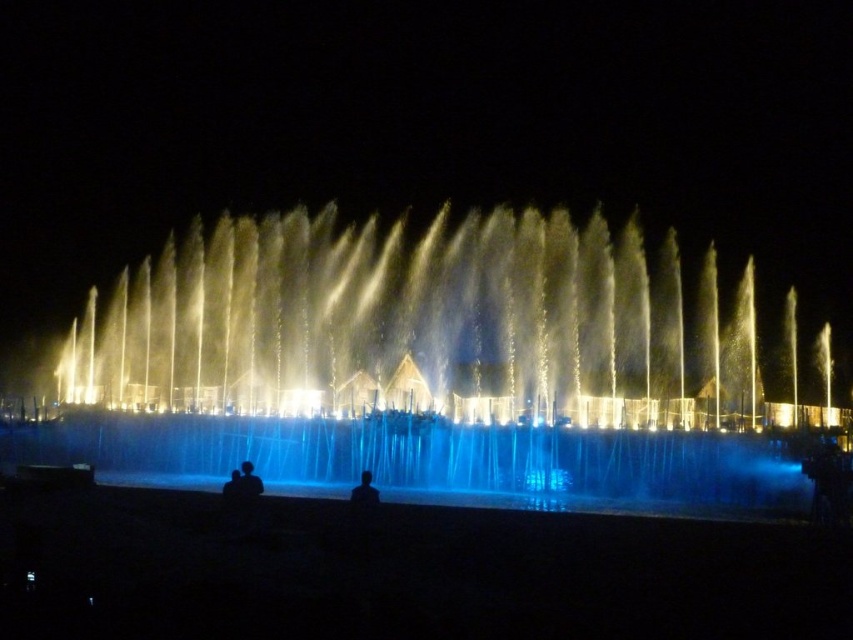
Does point (364, 483) come farther from viewer compared to point (244, 484)?

No.

Is black matte person at lower center thinner than silhouette figure at center?

Indeed, black matte person at lower center has a lesser width compared to silhouette figure at center.

In order to click on black matte person at lower center in this screenshot , I will do `click(364, 492)`.

You are a GUI agent. You are given a task and a screenshot of the screen. Output one action in this format:
    pyautogui.click(x=<x>, y=<y>)
    Task: Click on the black matte person at lower center
    This screenshot has height=640, width=853.
    Given the screenshot: What is the action you would take?
    pyautogui.click(x=364, y=492)

Between point (618, 352) and point (248, 465), which one is positioned in front?

Point (248, 465)

Is illuminated water jets at center closer to camera compared to silhouette figure at center?

No, it is not.

Image resolution: width=853 pixels, height=640 pixels. What are the coordinates of `illuminated water jets at center` in the screenshot? It's located at (432, 355).

I want to click on illuminated water jets at center, so click(432, 355).

Does blue liquid at center have a larger size compared to silhouette figure at center?

Yes, blue liquid at center is bigger than silhouette figure at center.

Locate an element on the screen. This screenshot has height=640, width=853. blue liquid at center is located at coordinates (432, 461).

In order to click on blue liquid at center in this screenshot , I will do `click(432, 461)`.